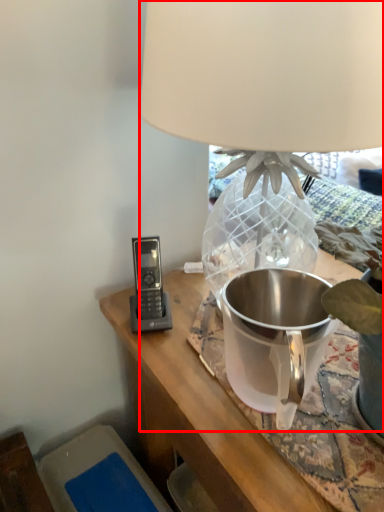
Question: Considering the relative positions of lamp (annotated by the red box) and appliance in the image provided, where is lamp (annotated by the red box) located with respect to the staircase?

Choices:
 (A) left
 (B) right

Answer: (B)